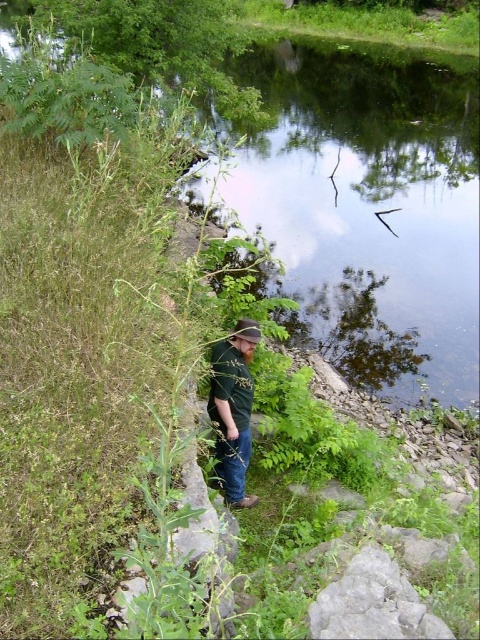
You are a photographer trying to capture the man in the scene. Since you want to focus on his upper body, you need to know the spatial relationship between the green matte shirt at center and the brown fabric baseball hat at center. Which one is positioned higher?

The brown fabric baseball hat at center is positioned higher than the green matte shirt at center because the green matte shirt at center is located below it.

You are a photographer trying to capture the man in the scene. You want to ensure both the green matte shirt at center and the brown fabric baseball hat at center are clearly visible in your photo. Based on their positions, which object might partially obscure the other?

The brown fabric baseball hat at center is behind the green matte shirt at center, so the green matte shirt at center might partially obscure the brown fabric baseball hat at center.

You are a photographer trying to capture the reflection of the man in the water. You notice a point at coordinates (233, 408). Based on the scene, can you determine if this point is part of the man or the surrounding environment?

The point at coordinates (233, 408) is on the green matte shirt at center, so it is part of the man.